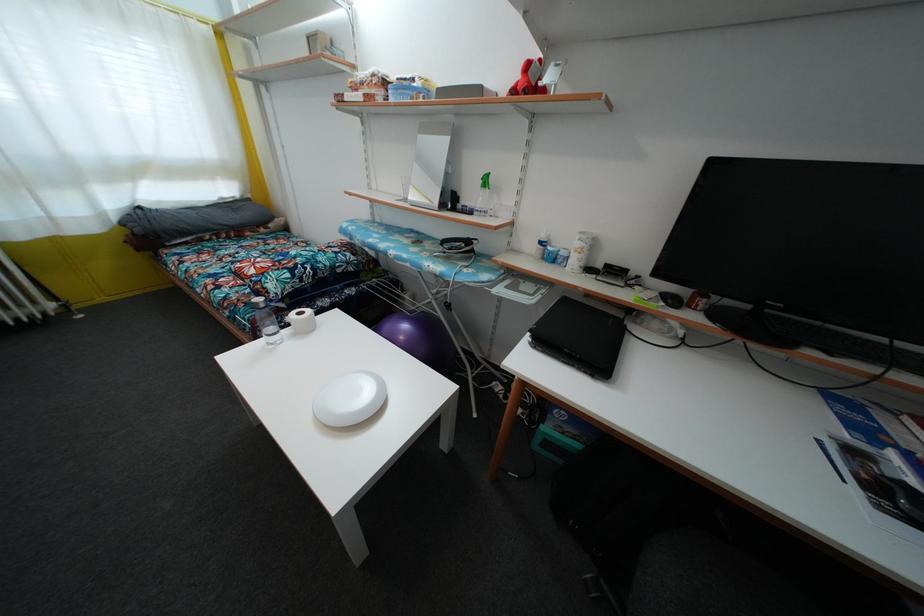
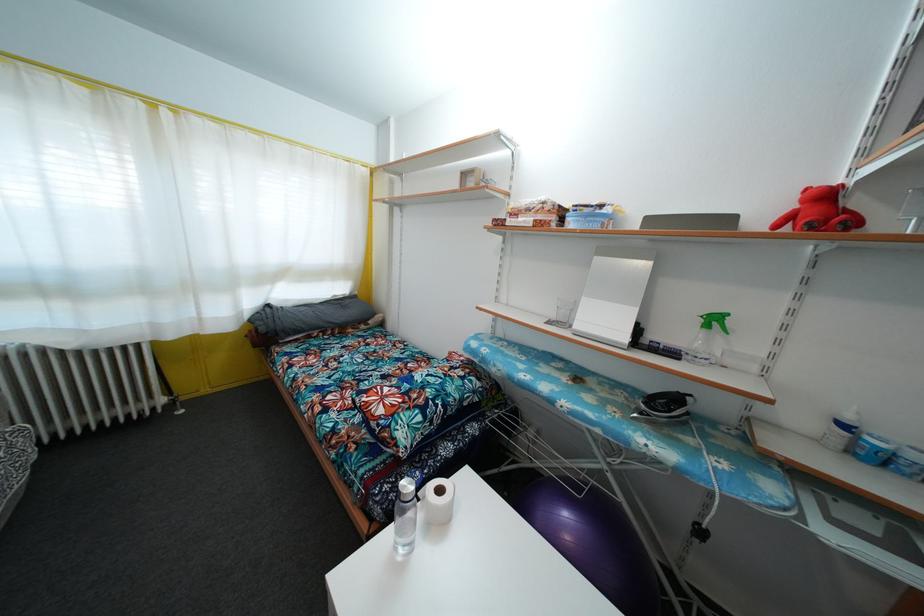
In the second image, find the point that corresponds to pixel 484 188 in the first image.

(706, 328)